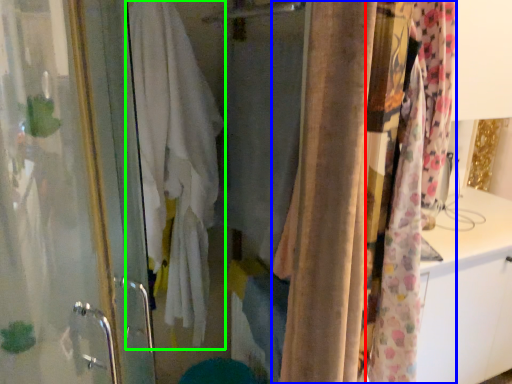
Question: Which object is the closest to the curtain (highlighted by a red box)? Choose among these: curtain (highlighted by a blue box) or bath towel (highlighted by a green box).

Choices:
 (A) curtain
 (B) bath towel

Answer: (A)